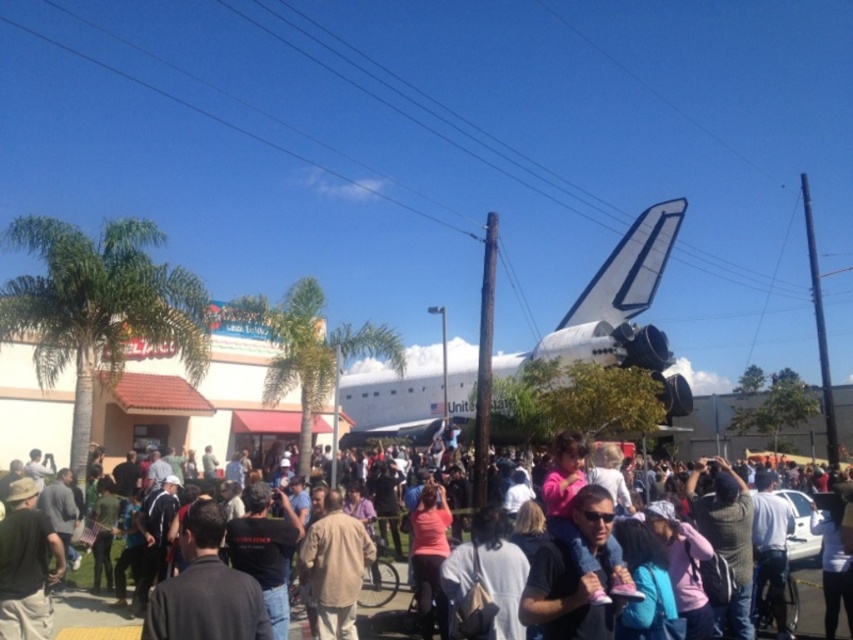
Does matte black crowd at center have a larger size compared to beige fabric shirt at center?

Yes.

Is matte black crowd at center positioned in front of beige fabric shirt at center?

Yes, it is in front of beige fabric shirt at center.

Between point (796, 525) and point (334, 589), which one is positioned behind?

Positioned behind is point (796, 525).

The image size is (853, 640). I want to click on matte black crowd at center, so click(86, 605).

Between white matte space shuttle at center and matte black crowd at center, which one is positioned lower?

matte black crowd at center is below.

Is white matte space shuttle at center below matte black crowd at center?

Actually, white matte space shuttle at center is above matte black crowd at center.

Who is more distant from viewer, (419, 408) or (393, 598)?

Positioned behind is point (419, 408).

Locate an element on the screen. Image resolution: width=853 pixels, height=640 pixels. white matte space shuttle at center is located at coordinates (618, 308).

Image resolution: width=853 pixels, height=640 pixels. What do you see at coordinates (618, 308) in the screenshot?
I see `white matte space shuttle at center` at bounding box center [618, 308].

From the picture: Does white matte space shuttle at center lie in front of beige fabric shirt at center?

No, white matte space shuttle at center is further to the viewer.

Measure the distance between point (492, 378) and camera.

They are 119.32 meters apart.

You are a GUI agent. You are given a task and a screenshot of the screen. Output one action in this format:
    pyautogui.click(x=<x>, y=<y>)
    Task: Click on the white matte space shuttle at center
    The image size is (853, 640).
    Given the screenshot: What is the action you would take?
    pyautogui.click(x=618, y=308)